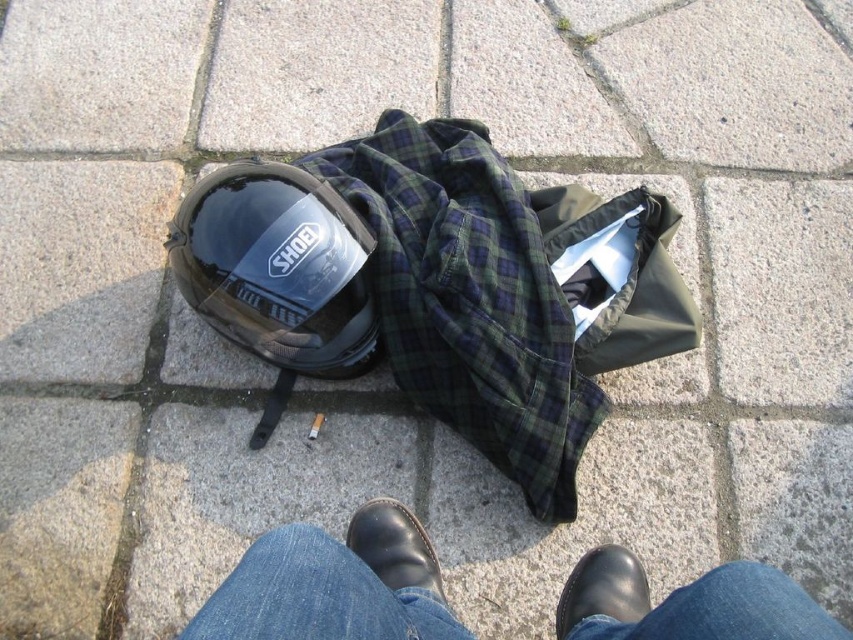
Is glossy black helmet at center below jeans at lower center?

Incorrect, glossy black helmet at center is not positioned below jeans at lower center.

Can you confirm if glossy black helmet at center is bigger than jeans at lower center?

Actually, glossy black helmet at center might be smaller than jeans at lower center.

Is point (178, 252) positioned before point (340, 566)?

No, it is behind (340, 566).

Where is `glossy black helmet at center`? Image resolution: width=853 pixels, height=640 pixels. glossy black helmet at center is located at coordinates (277, 268).

Is black leather shoe at center above black leather shoe at lower center?

Yes, black leather shoe at center is above black leather shoe at lower center.

Between point (363, 547) and point (567, 588), which one is positioned in front?

Point (567, 588) is more forward.

Image resolution: width=853 pixels, height=640 pixels. Find the location of `black leather shoe at center`. black leather shoe at center is located at coordinates (393, 547).

Who is more forward, (344, 550) or (347, 525)?

Point (344, 550) is in front.

Between jeans at lower center and black leather shoe at center, which one appears on the left side from the viewer's perspective?

Positioned to the left is black leather shoe at center.

The image size is (853, 640). In order to click on jeans at lower center in this screenshot , I will do pyautogui.click(x=316, y=596).